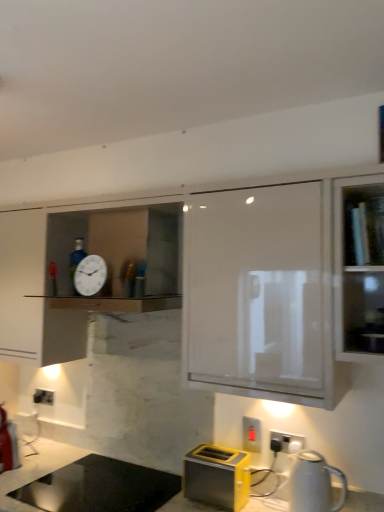
How much space does white plastic electric outlet at lower left, the 1th electric outlet when ordered from back to front, occupy vertically?

white plastic electric outlet at lower left, the 1th electric outlet when ordered from back to front, is 9.63 centimeters tall.

How much space does white plastic electric outlet at lower left, arranged as the third electric outlet when viewed from the right, occupy horizontally?

white plastic electric outlet at lower left, arranged as the third electric outlet when viewed from the right, is 6.51 centimeters wide.

Image resolution: width=384 pixels, height=512 pixels. Describe the element at coordinates (90, 275) in the screenshot. I see `white glossy clock at upper center` at that location.

What do you see at coordinates (217, 476) in the screenshot?
I see `yellow metallic toaster at lower center` at bounding box center [217, 476].

Describe the element at coordinates (363, 225) in the screenshot. I see `clear glass shelf at upper right` at that location.

The width and height of the screenshot is (384, 512). Describe the element at coordinates (251, 434) in the screenshot. I see `yellow plastic electric outlet at lower right, arranged as the second electric outlet when viewed from the left` at that location.

This screenshot has width=384, height=512. In order to click on yellow plastic electric outlet at lower right, arranged as the 2th electric outlet when viewed from the front in this screenshot , I will do `click(251, 434)`.

This screenshot has width=384, height=512. Describe the element at coordinates (288, 441) in the screenshot. I see `black plastic electrical outlet at lower center, marked as the first electric outlet in a right-to-left arrangement` at that location.

I want to click on white plastic electric outlet at lower left, the 1th electric outlet when ordered from back to front, so click(43, 397).

From the image's perspective, which object appears higher, yellow plastic electric outlet at lower right, positioned as the second electric outlet in back-to-front order, or white glossy clock at upper center?

white glossy clock at upper center is shown above in the image.

Considering the relative sizes of yellow plastic electric outlet at lower right, positioned as the second electric outlet in back-to-front order, and white glossy clock at upper center in the image provided, is yellow plastic electric outlet at lower right, positioned as the second electric outlet in back-to-front order, thinner than white glossy clock at upper center?

Correct, the width of yellow plastic electric outlet at lower right, positioned as the second electric outlet in back-to-front order, is less than that of white glossy clock at upper center.

Is yellow plastic electric outlet at lower right, arranged as the 2th electric outlet when viewed from the front, turned away from white glossy clock at upper center?

That's not correct — yellow plastic electric outlet at lower right, arranged as the 2th electric outlet when viewed from the front, is not looking away from white glossy clock at upper center.

Is white plastic electric outlet at lower left, which appears as the 3th electric outlet when viewed from the front, wider or thinner than white glossy cabinet at upper center?

Considering their sizes, white plastic electric outlet at lower left, which appears as the 3th electric outlet when viewed from the front, looks slimmer than white glossy cabinet at upper center.

Which is in front, white plastic electric outlet at lower left, marked as the first electric outlet in a left-to-right arrangement, or white glossy cabinet at upper center?

white glossy cabinet at upper center is closer to the camera.

Considering the sizes of objects white plastic electric outlet at lower left, which appears as the 3th electric outlet when viewed from the front, and white glossy cabinet at upper center in the image provided, who is shorter, white plastic electric outlet at lower left, which appears as the 3th electric outlet when viewed from the front, or white glossy cabinet at upper center?

Standing shorter between the two is white plastic electric outlet at lower left, which appears as the 3th electric outlet when viewed from the front.

From the image's perspective, which is below, white plastic electric outlet at lower left, which appears as the 3th electric outlet when viewed from the front, or white glossy cabinet at upper center?

white plastic electric outlet at lower left, which appears as the 3th electric outlet when viewed from the front, is shown below in the image.

Is white glossy kettle at lower right facing away from white plastic electric outlet at lower left, marked as the first electric outlet in a left-to-right arrangement?

No, white glossy kettle at lower right's orientation is not away from white plastic electric outlet at lower left, marked as the first electric outlet in a left-to-right arrangement.

Between white glossy kettle at lower right and white plastic electric outlet at lower left, which appears as the 3th electric outlet when viewed from the front, which one appears on the right side from the viewer's perspective?

white glossy kettle at lower right is more to the right.

From a real-world perspective, is white glossy kettle at lower right located beneath white plastic electric outlet at lower left, marked as the first electric outlet in a left-to-right arrangement?

Yes, from a real-world perspective, white glossy kettle at lower right is below white plastic electric outlet at lower left, marked as the first electric outlet in a left-to-right arrangement.

Where is `kitchen appliance on the right of white plastic electric outlet at lower left, arranged as the third electric outlet when viewed from the right`? Image resolution: width=384 pixels, height=512 pixels. kitchen appliance on the right of white plastic electric outlet at lower left, arranged as the third electric outlet when viewed from the right is located at coordinates (314, 484).

Considering the relative positions of white glossy clock at upper center and black plastic electrical outlet at lower center, placed as the third electric outlet when sorted from back to front, in the image provided, is white glossy clock at upper center to the left of black plastic electrical outlet at lower center, placed as the third electric outlet when sorted from back to front, from the viewer's perspective?

Indeed, white glossy clock at upper center is positioned on the left side of black plastic electrical outlet at lower center, placed as the third electric outlet when sorted from back to front.

Considering the relative positions of white glossy clock at upper center and black plastic electrical outlet at lower center, the third electric outlet when ordered from left to right, in the image provided, is white glossy clock at upper center in front of black plastic electrical outlet at lower center, the third electric outlet when ordered from left to right,?

Yes, it is.

Is white glossy clock at upper center turned away from black plastic electrical outlet at lower center, placed as the third electric outlet when sorted from back to front?

No, white glossy clock at upper center's orientation is not away from black plastic electrical outlet at lower center, placed as the third electric outlet when sorted from back to front.

How distant is white glossy clock at upper center from black plastic electrical outlet at lower center, placed as the third electric outlet when sorted from back to front?

39.30 inches.

Would you consider black plastic electrical outlet at lower center, the third electric outlet when ordered from left to right, to be distant from white glossy clock at upper center?

No, black plastic electrical outlet at lower center, the third electric outlet when ordered from left to right, is not far away from white glossy clock at upper center.

Is black plastic electrical outlet at lower center, placed as the third electric outlet when sorted from back to front, shorter than white glossy clock at upper center?

Correct, black plastic electrical outlet at lower center, placed as the third electric outlet when sorted from back to front, is not as tall as white glossy clock at upper center.

Considering the positions of objects black plastic electrical outlet at lower center, placed as the third electric outlet when sorted from back to front, and white glossy clock at upper center in the image provided, who is more to the right, black plastic electrical outlet at lower center, placed as the third electric outlet when sorted from back to front, or white glossy clock at upper center?

From the viewer's perspective, black plastic electrical outlet at lower center, placed as the third electric outlet when sorted from back to front, appears more on the right side.

From a real-world perspective, which object stands above the other?

white glossy clock at upper center, from a real-world perspective.

Choose the correct answer: Is white glossy clock at upper center inside yellow metallic toaster at lower center or outside it?

white glossy clock at upper center exists outside the volume of yellow metallic toaster at lower center.

Does point (91, 288) come behind point (192, 465)?

Yes, point (91, 288) is behind point (192, 465).

Find the location of a particular element. clock above the yellow metallic toaster at lower center (from a real-world perspective) is located at coordinates (90, 275).

Is white glossy clock at upper center shorter than yellow metallic toaster at lower center?

Indeed, white glossy clock at upper center has a lesser height compared to yellow metallic toaster at lower center.

Can you confirm if white glossy cabinet at upper center is positioned to the right of clear glass shelf at upper right?

Incorrect, white glossy cabinet at upper center is not on the right side of clear glass shelf at upper right.

From a real-world perspective, does white glossy cabinet at upper center stand above clear glass shelf at upper right?

No, from a real-world perspective, white glossy cabinet at upper center is not on top of clear glass shelf at upper right.

Is white glossy cabinet at upper center oriented towards clear glass shelf at upper right?

Yes, white glossy cabinet at upper center is oriented towards clear glass shelf at upper right.

Starting from the white glossy clock at upper center, which electric outlet is the 1st one to the right? Please provide its 2D coordinates.

[(251, 434)]

This screenshot has height=512, width=384. Find the location of `cabinetry in front of the white plastic electric outlet at lower left, the 1th electric outlet when ordered from back to front`. cabinetry in front of the white plastic electric outlet at lower left, the 1th electric outlet when ordered from back to front is located at coordinates 206,283.

Looking at the image, which one is located further to white glossy kettle at lower right, black plastic electrical outlet at lower center, the third electric outlet when ordered from left to right, or white glossy clock at upper center?

white glossy clock at upper center lies further to white glossy kettle at lower right than the other object.

Estimate the real-world distances between objects in this image. Which object is closer to yellow plastic electric outlet at lower right, arranged as the second electric outlet when viewed from the left, white plastic electric outlet at lower left, arranged as the third electric outlet when viewed from the right, or clear glass shelf at upper right?

Based on the image, clear glass shelf at upper right appears to be nearer to yellow plastic electric outlet at lower right, arranged as the second electric outlet when viewed from the left.

Considering their positions, is white glossy cabinet at upper center positioned further to black plastic electrical outlet at lower center, placed as the third electric outlet when sorted from back to front, than white glossy kettle at lower right?

white glossy cabinet at upper center is further to black plastic electrical outlet at lower center, placed as the third electric outlet when sorted from back to front.

From the image, which object appears to be nearer to yellow plastic electric outlet at lower right, arranged as the 2th electric outlet when viewed from the front, black plastic electrical outlet at lower center, marked as the first electric outlet in a right-to-left arrangement, or marble countertop at lower center?

black plastic electrical outlet at lower center, marked as the first electric outlet in a right-to-left arrangement, lies closer to yellow plastic electric outlet at lower right, arranged as the 2th electric outlet when viewed from the front, than the other object.

Looking at the image, which one is located further to marble countertop at lower center, white glossy clock at upper center or black plastic electrical outlet at lower center, the 1th electric outlet from the front?

black plastic electrical outlet at lower center, the 1th electric outlet from the front, is further to marble countertop at lower center.

Based on their spatial positions, is marble countertop at lower center or yellow plastic electric outlet at lower right, positioned as the second electric outlet in back-to-front order, closer to yellow metallic toaster at lower center?

yellow plastic electric outlet at lower right, positioned as the second electric outlet in back-to-front order, is positioned closer to the anchor yellow metallic toaster at lower center.

Based on their spatial positions, is marble countertop at lower center or white plastic electric outlet at lower left, marked as the first electric outlet in a left-to-right arrangement, further from white glossy clock at upper center?

Among the two, white plastic electric outlet at lower left, marked as the first electric outlet in a left-to-right arrangement, is located further to white glossy clock at upper center.

When comparing their distances from yellow plastic electric outlet at lower right, arranged as the 2th electric outlet when viewed from the front, does clear glass shelf at upper right or marble countertop at lower center seem closer?

Among the two, clear glass shelf at upper right is located nearer to yellow plastic electric outlet at lower right, arranged as the 2th electric outlet when viewed from the front.

You are a GUI agent. You are given a task and a screenshot of the screen. Output one action in this format:
    pyautogui.click(x=<x>, y=<y>)
    Task: Click on the cabinetry between white plastic electric outlet at lower left, arranged as the third electric outlet when viewed from the right, and clear glass shelf at upper right, in the horizontal direction
    
    Given the screenshot: What is the action you would take?
    pyautogui.click(x=206, y=283)

Image resolution: width=384 pixels, height=512 pixels. Find the location of `electric outlet between white glossy cabinet at upper center and black plastic electrical outlet at lower center, the third electric outlet when ordered from left to right, in the up-down direction`. electric outlet between white glossy cabinet at upper center and black plastic electrical outlet at lower center, the third electric outlet when ordered from left to right, in the up-down direction is located at coordinates (251, 434).

At what (x,y) coordinates should I click in order to perform the action: click on clock between white glossy cabinet at upper center and white plastic electric outlet at lower left, arranged as the third electric outlet when viewed from the right, from front to back. Please return your answer as a coordinate pair (x, y). Looking at the image, I should click on (90, 275).

At what (x,y) coordinates should I click in order to perform the action: click on electric outlet located between white plastic electric outlet at lower left, arranged as the third electric outlet when viewed from the right, and black plastic electrical outlet at lower center, the third electric outlet when ordered from left to right, in the left-right direction. Please return your answer as a coordinate pair (x, y). This screenshot has width=384, height=512. Looking at the image, I should click on (251, 434).